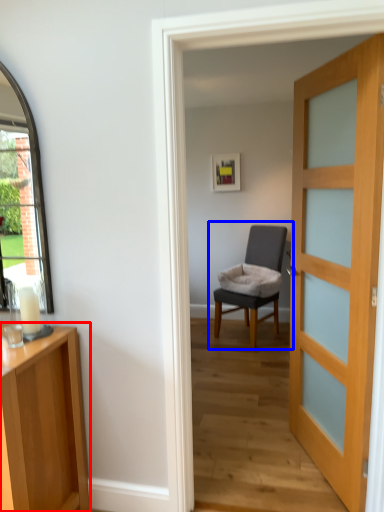
Question: Which of the following is the farthest to the observer, cabinetry (highlighted by a red box) or chair (highlighted by a blue box)?

Choices:
 (A) cabinetry
 (B) chair

Answer: (B)